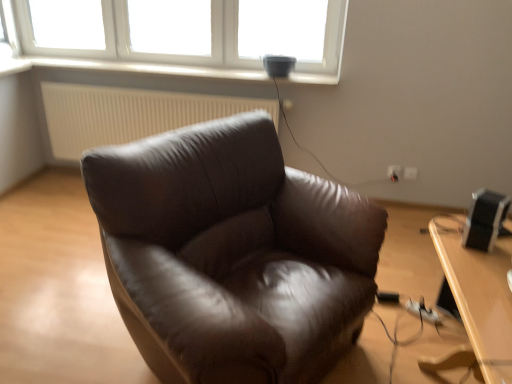
What do you see at coordinates (484, 219) in the screenshot? The image size is (512, 384). I see `black plastic speaker at right` at bounding box center [484, 219].

What do you see at coordinates (477, 287) in the screenshot? I see `light brown wooden table at lower right` at bounding box center [477, 287].

Describe the element at coordinates (394, 172) in the screenshot. I see `white plastic electric outlet at center-right, the first electric outlet from the left` at that location.

Where is `white plastic electric outlet at lower right, arranged as the 1th electric outlet when viewed from the right`? The width and height of the screenshot is (512, 384). white plastic electric outlet at lower right, arranged as the 1th electric outlet when viewed from the right is located at coordinates (410, 173).

What is the approximate height of white plastic electric outlet at lower right, acting as the second electric outlet starting from the left?

white plastic electric outlet at lower right, acting as the second electric outlet starting from the left, is 3.61 inches tall.

Locate an element on the screen. This screenshot has height=384, width=512. black plastic speaker at right is located at coordinates (484, 219).

Can you tell me how much white plastic electric outlet at lower right, acting as the second electric outlet starting from the left, and light brown wooden table at lower right differ in facing direction?

There is a 89.1-degree angle between the facing directions of white plastic electric outlet at lower right, acting as the second electric outlet starting from the left, and light brown wooden table at lower right.

Is white plastic electric outlet at lower right, acting as the second electric outlet starting from the left, situated inside light brown wooden table at lower right or outside?

white plastic electric outlet at lower right, acting as the second electric outlet starting from the left, cannot be found inside light brown wooden table at lower right.

From the image's perspective, does white plastic electric outlet at lower right, arranged as the 1th electric outlet when viewed from the right, appear higher than light brown wooden table at lower right?

Yes, from the image's perspective, white plastic electric outlet at lower right, arranged as the 1th electric outlet when viewed from the right, is over light brown wooden table at lower right.

Is white plastic electric outlet at lower right, acting as the second electric outlet starting from the left, facing away from light brown wooden table at lower right?

No, light brown wooden table at lower right is not at the back of white plastic electric outlet at lower right, acting as the second electric outlet starting from the left.

Are white plastic electric outlet at lower right, arranged as the 1th electric outlet when viewed from the right, and white plastic window at upper center making contact?

white plastic electric outlet at lower right, arranged as the 1th electric outlet when viewed from the right, and white plastic window at upper center are not in contact.

Would you say white plastic electric outlet at lower right, arranged as the 1th electric outlet when viewed from the right, contains white plastic window at upper center?

No, white plastic window at upper center is not surrounded by white plastic electric outlet at lower right, arranged as the 1th electric outlet when viewed from the right.

From the image's perspective, is white plastic electric outlet at lower right, acting as the second electric outlet starting from the left, located above white plastic window at upper center?

Incorrect, from the image's perspective, white plastic electric outlet at lower right, acting as the second electric outlet starting from the left, is lower than white plastic window at upper center.

Is white plastic electric outlet at lower right, arranged as the 1th electric outlet when viewed from the right, positioned behind white plastic window at upper center?

Yes, white plastic electric outlet at lower right, arranged as the 1th electric outlet when viewed from the right, is further from the viewer.

Which of these two, white plastic electric outlet at lower right, arranged as the 1th electric outlet when viewed from the right, or black plastic speaker at right, is bigger?

With larger size is black plastic speaker at right.

Is point (410, 178) closer to camera compared to point (476, 204)?

No.

From a real-world perspective, which object rests below the other?

From a 3D spatial view, white plastic electric outlet at lower right, arranged as the 1th electric outlet when viewed from the right, is below.

Are white plastic electric outlet at lower right, acting as the second electric outlet starting from the left, and black plastic speaker at right located far from each other?

Yes, white plastic electric outlet at lower right, acting as the second electric outlet starting from the left, and black plastic speaker at right are quite far apart.

Does black plastic speaker at right appear on the left side of white plastic window at upper center?

No, black plastic speaker at right is not to the left of white plastic window at upper center.

Which is farther from the camera, (490, 217) or (15, 4)?

The point (15, 4) is behind.

In the scene shown: Which object is thinner, black plastic speaker at right or white plastic window at upper center?

white plastic window at upper center is thinner.

Looking at this image, is black plastic speaker at right completely or partially outside of white plastic window at upper center?

That's correct, black plastic speaker at right is outside of white plastic window at upper center.

Locate an element on the screen. This screenshot has width=512, height=384. electric outlet above the white plastic electric outlet at center-right, the first electric outlet from the left (from a real-world perspective) is located at coordinates (410, 173).

Is white plastic electric outlet at center-right, which is the 2th electric outlet in right-to-left order, in contact with white plastic electric outlet at lower right, acting as the second electric outlet starting from the left?

Yes, white plastic electric outlet at center-right, which is the 2th electric outlet in right-to-left order, is in contact with white plastic electric outlet at lower right, acting as the second electric outlet starting from the left.

Measure the distance from white plastic electric outlet at center-right, which is the 2th electric outlet in right-to-left order, to white plastic electric outlet at lower right, acting as the second electric outlet starting from the left.

white plastic electric outlet at center-right, which is the 2th electric outlet in right-to-left order, is 2.92 inches away from white plastic electric outlet at lower right, acting as the second electric outlet starting from the left.

Between white plastic electric outlet at center-right, which is the 2th electric outlet in right-to-left order, and white plastic electric outlet at lower right, arranged as the 1th electric outlet when viewed from the right, which one has more height?

white plastic electric outlet at center-right, which is the 2th electric outlet in right-to-left order.

Is black plastic speaker at right inside white plastic electric outlet at center-right, which is the 2th electric outlet in right-to-left order?

No, white plastic electric outlet at center-right, which is the 2th electric outlet in right-to-left order, does not contain black plastic speaker at right.

Which is more to the left, white plastic electric outlet at center-right, the first electric outlet from the left, or black plastic speaker at right?

black plastic speaker at right.

Could you tell me if white plastic electric outlet at center-right, which is the 2th electric outlet in right-to-left order, is turned towards black plastic speaker at right?

Yes, white plastic electric outlet at center-right, which is the 2th electric outlet in right-to-left order, is aimed at black plastic speaker at right.

Which object is closer to the camera taking this photo, black plastic speaker at right or white textured radiator at upper center?

black plastic speaker at right is more forward.

Looking at their sizes, would you say black plastic speaker at right is wider or thinner than white textured radiator at upper center?

Clearly, black plastic speaker at right has more width compared to white textured radiator at upper center.

Could white textured radiator at upper center be considered to be inside black plastic speaker at right?

No.

The width and height of the screenshot is (512, 384). What are the coordinates of `table below the white plastic electric outlet at lower right, acting as the second electric outlet starting from the left (from the image's perspective)` in the screenshot? It's located at (477, 287).

From a real-world perspective, which electric outlet is the 1st one underneath the white plastic window at upper center? Please provide its 2D coordinates.

[(410, 173)]

Based on their spatial positions, is light brown wooden table at lower right or white plastic electric outlet at center-right, which is the 2th electric outlet in right-to-left order, closer to white plastic electric outlet at lower right, arranged as the 1th electric outlet when viewed from the right?

Among the two, white plastic electric outlet at center-right, which is the 2th electric outlet in right-to-left order, is located nearer to white plastic electric outlet at lower right, arranged as the 1th electric outlet when viewed from the right.

From the image, which object appears to be farther from white plastic electric outlet at lower right, acting as the second electric outlet starting from the left, white plastic window at upper center or white plastic electric outlet at center-right, which is the 2th electric outlet in right-to-left order?

white plastic window at upper center lies further to white plastic electric outlet at lower right, acting as the second electric outlet starting from the left, than the other object.

When comparing their distances from black plastic speaker at right, does white plastic window at upper center or white plastic electric outlet at lower right, arranged as the 1th electric outlet when viewed from the right, seem further?

white plastic window at upper center is further to black plastic speaker at right.

Looking at the image, which one is located closer to light brown wooden table at lower right, white plastic electric outlet at lower right, acting as the second electric outlet starting from the left, or white plastic window at upper center?

white plastic electric outlet at lower right, acting as the second electric outlet starting from the left.

Which object lies nearer to the anchor point white plastic electric outlet at lower right, acting as the second electric outlet starting from the left, white plastic window at upper center or white textured radiator at upper center?

The object closer to white plastic electric outlet at lower right, acting as the second electric outlet starting from the left, is white textured radiator at upper center.

From the image, which object appears to be farther from white textured radiator at upper center, white plastic electric outlet at lower right, acting as the second electric outlet starting from the left, or white plastic electric outlet at center-right, the first electric outlet from the left?

white plastic electric outlet at lower right, acting as the second electric outlet starting from the left, is further to white textured radiator at upper center.

Based on their spatial positions, is black plastic speaker at right or light brown wooden table at lower right closer to white plastic electric outlet at lower right, arranged as the 1th electric outlet when viewed from the right?

black plastic speaker at right is positioned closer to the anchor white plastic electric outlet at lower right, arranged as the 1th electric outlet when viewed from the right.

Estimate the real-world distances between objects in this image. Which object is further from white plastic electric outlet at lower right, acting as the second electric outlet starting from the left, white plastic electric outlet at center-right, which is the 2th electric outlet in right-to-left order, or black plastic speaker at right?

black plastic speaker at right is further to white plastic electric outlet at lower right, acting as the second electric outlet starting from the left.

Locate an element on the screen. Image resolution: width=512 pixels, height=384 pixels. speaker located between white textured radiator at upper center and white plastic electric outlet at lower right, acting as the second electric outlet starting from the left, in the left-right direction is located at coordinates (484, 219).

This screenshot has width=512, height=384. Find the location of `window situated between white textured radiator at upper center and white plastic electric outlet at lower right, acting as the second electric outlet starting from the left, from left to right`. window situated between white textured radiator at upper center and white plastic electric outlet at lower right, acting as the second electric outlet starting from the left, from left to right is located at coordinates tap(143, 53).

Locate an element on the screen. The image size is (512, 384). electric outlet between light brown wooden table at lower right and white plastic electric outlet at lower right, acting as the second electric outlet starting from the left, along the z-axis is located at coordinates (394, 172).

Where is `radiator between light brown wooden table at lower right and white plastic electric outlet at center-right, the first electric outlet from the left, from front to back`? radiator between light brown wooden table at lower right and white plastic electric outlet at center-right, the first electric outlet from the left, from front to back is located at coordinates (129, 114).